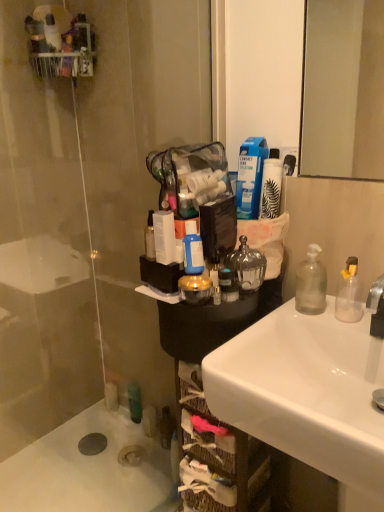
Question: Is white glossy sink at lower right to the right of blue matte bottle at center, the 1th bottle viewed from the left, from the viewer's perspective?

Choices:
 (A) no
 (B) yes

Answer: (B)

Question: Does white glossy sink at lower right have a larger size compared to blue matte bottle at center, which is counted as the second bottle, starting from the right?

Choices:
 (A) no
 (B) yes

Answer: (B)

Question: Does white glossy sink at lower right have a greater height compared to blue matte bottle at center, which is counted as the second bottle, starting from the right?

Choices:
 (A) no
 (B) yes

Answer: (B)

Question: Can you confirm if white glossy sink at lower right is positioned to the left of blue matte bottle at center, which is counted as the second bottle, starting from the right?

Choices:
 (A) no
 (B) yes

Answer: (A)

Question: Can you confirm if white glossy sink at lower right is smaller than blue matte bottle at center, the 1th bottle viewed from the left?

Choices:
 (A) yes
 (B) no

Answer: (B)

Question: Is clear glass jar at center, which is counted as the second toiletry, starting from the top, wider or thinner than transparent glass door at left?

Choices:
 (A) wide
 (B) thin

Answer: (A)

Question: In terms of size, does clear glass jar at center, which is counted as the second toiletry, starting from the top, appear bigger or smaller than transparent glass door at left?

Choices:
 (A) big
 (B) small

Answer: (B)

Question: Which is correct: clear glass jar at center, placed as the first toiletry when sorted from bottom to top, is inside transparent glass door at left, or outside of it?

Choices:
 (A) outside
 (B) inside

Answer: (A)

Question: Is point (238, 251) closer or farther from the camera than point (49, 421)?

Choices:
 (A) closer
 (B) farther

Answer: (A)

Question: Is point (278, 189) closer or farther from the camera than point (248, 450)?

Choices:
 (A) farther
 (B) closer

Answer: (A)

Question: Relative to woven brown basket at lower center, is white matte bottle at upper right, which is counted as the 1th toiletry, starting from the top, in front or behind?

Choices:
 (A) front
 (B) behind

Answer: (B)

Question: Is white matte bottle at upper right, which is counted as the 1th toiletry, starting from the top, spatially inside woven brown basket at lower center, or outside of it?

Choices:
 (A) inside
 (B) outside

Answer: (B)

Question: Is white matte bottle at upper right, the 2th toiletry ordered from the bottom, bigger or smaller than woven brown basket at lower center?

Choices:
 (A) big
 (B) small

Answer: (B)

Question: Is blue matte bottle at center, the 1th bottle viewed from the left, wider or thinner than white matte bottle at upper right, which is counted as the 1th toiletry, starting from the top?

Choices:
 (A) thin
 (B) wide

Answer: (A)

Question: Which is correct: blue matte bottle at center, the 1th bottle viewed from the left, is inside white matte bottle at upper right, the 2th toiletry ordered from the bottom, or outside of it?

Choices:
 (A) inside
 (B) outside

Answer: (B)